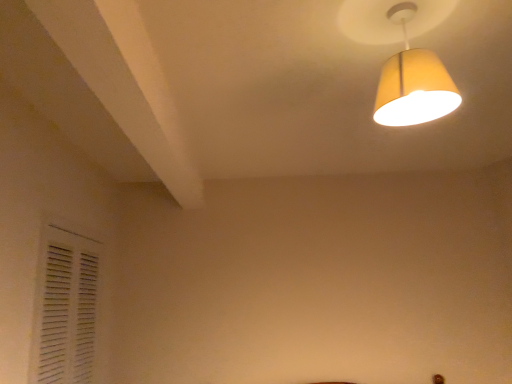
Question: Is white matte shutter at lower left to the left of yellow fabric lampshade at upper right from the viewer's perspective?

Choices:
 (A) yes
 (B) no

Answer: (A)

Question: Considering the relative sizes of white matte shutter at lower left and yellow fabric lampshade at upper right in the image provided, is white matte shutter at lower left bigger than yellow fabric lampshade at upper right?

Choices:
 (A) no
 (B) yes

Answer: (B)

Question: Does white matte shutter at lower left touch yellow fabric lampshade at upper right?

Choices:
 (A) yes
 (B) no

Answer: (B)

Question: Can we say white matte shutter at lower left lies outside yellow fabric lampshade at upper right?

Choices:
 (A) no
 (B) yes

Answer: (B)

Question: Can you confirm if white matte shutter at lower left is taller than yellow fabric lampshade at upper right?

Choices:
 (A) yes
 (B) no

Answer: (A)

Question: Is white matte shutter at lower left turned away from yellow fabric lampshade at upper right?

Choices:
 (A) no
 (B) yes

Answer: (A)

Question: Can you confirm if yellow fabric lampshade at upper right is wider than white matte shutter at lower left?

Choices:
 (A) no
 (B) yes

Answer: (B)

Question: Is yellow fabric lampshade at upper right oriented away from white matte shutter at lower left?

Choices:
 (A) no
 (B) yes

Answer: (A)

Question: Is yellow fabric lampshade at upper right behind white matte shutter at lower left?

Choices:
 (A) no
 (B) yes

Answer: (A)

Question: From a real-world perspective, is yellow fabric lampshade at upper right under white matte shutter at lower left?

Choices:
 (A) yes
 (B) no

Answer: (B)

Question: Is yellow fabric lampshade at upper right far away from white matte shutter at lower left?

Choices:
 (A) yes
 (B) no

Answer: (A)

Question: Considering the relative sizes of yellow fabric lampshade at upper right and white matte shutter at lower left in the image provided, is yellow fabric lampshade at upper right taller than white matte shutter at lower left?

Choices:
 (A) yes
 (B) no

Answer: (B)

Question: Considering the positions of yellow fabric lampshade at upper right and white matte shutter at lower left in the image, is yellow fabric lampshade at upper right bigger or smaller than white matte shutter at lower left?

Choices:
 (A) big
 (B) small

Answer: (B)